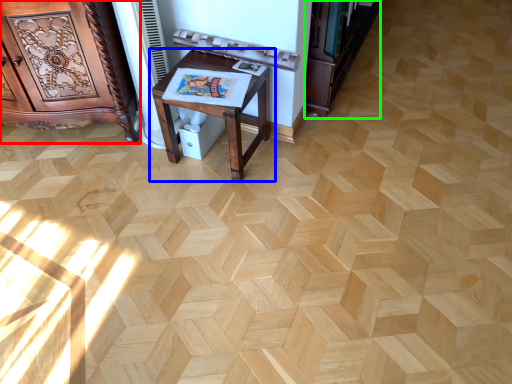
Question: Which object is positioned farthest from furniture (highlighted by a red box)? Select from table (highlighted by a blue box) and bookshelf (highlighted by a green box).

Choices:
 (A) table
 (B) bookshelf

Answer: (B)